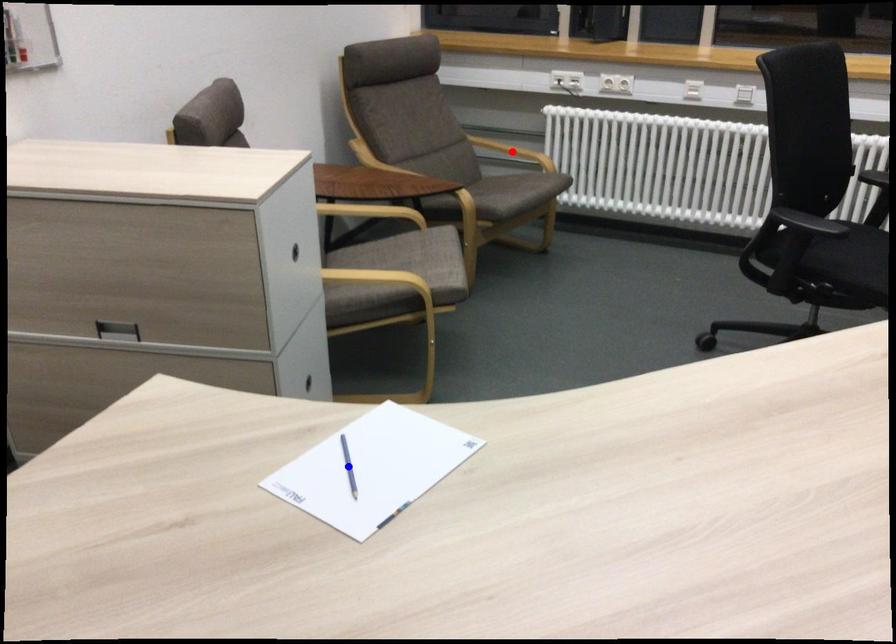
Question: Two points are marked on the image. Which point is closer to the camera?

Choices:
 (A) Blue point is closer.
 (B) Red point is closer.

Answer: (A)